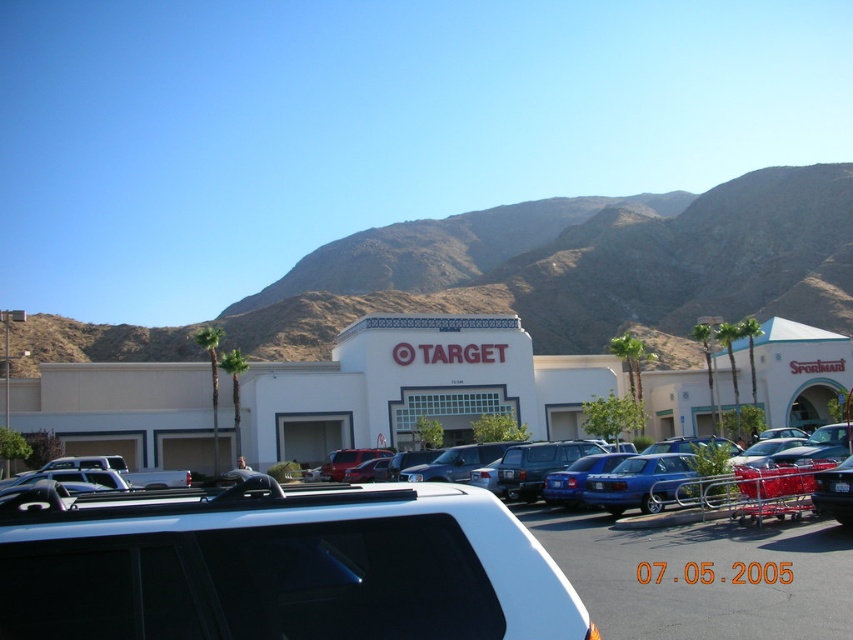
You are a customer standing in the parking lot of the Target store. You see a white plastic car at center and a blue metallic sedan at center. Which vehicle is closer to you?

The white plastic car at center is closer to the viewer than the blue metallic sedan at center, so the white plastic car at center is closer to you.

Looking at this image, you are standing next to the camera and want to place a toy car in the parking lot so that it is exactly 5 meters away from the camera. Can you place the white plastic car at center in such a way that it meets this requirement?

The white plastic car at center is already 5.49 meters away from the camera, which is slightly more than 5 meters. Therefore, you can position it there to meet the requirement as it is close enough.

You are a customer arriving at the Target store and see the brown rocky mountain at upper center and the blue metallic sedan at center. Which object is closer to you as you face the Target store?

The brown rocky mountain at upper center is closer to you because the blue metallic sedan at center is behind it.